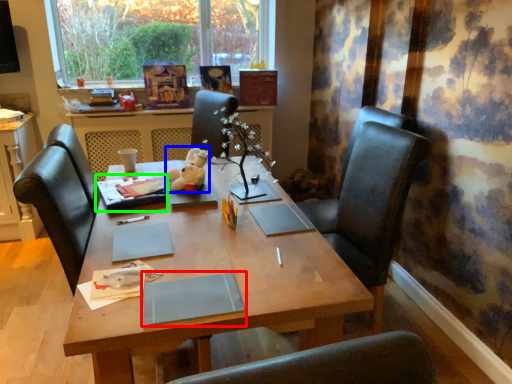
Question: Estimate the real-world distances between objects in this image. Which object is closer to notebook (highlighted by a red box), toy (highlighted by a blue box) or book (highlighted by a green box)?

Choices:
 (A) toy
 (B) book

Answer: (B)